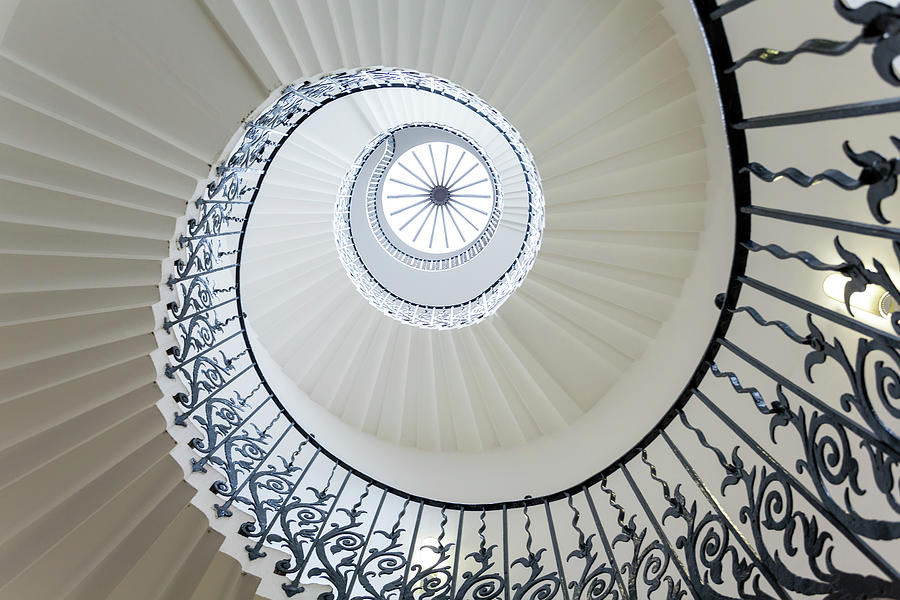
Locate an element on the screen. This screenshot has width=900, height=600. black center of large light fixture is located at coordinates (438, 197).